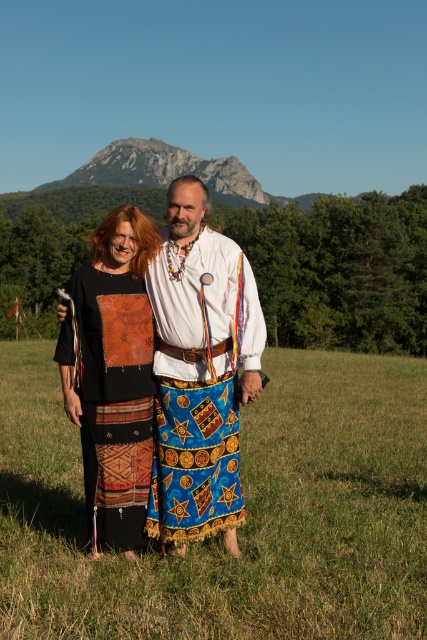
Question: Does textured fabric skirt at center appear on the left side of rugged stone mountain at upper center?

Choices:
 (A) yes
 (B) no

Answer: (B)

Question: Is textured fabric skirt at center above rugged stone mountain at upper center?

Choices:
 (A) no
 (B) yes

Answer: (A)

Question: Estimate the real-world distances between objects in this image. Which object is farther from the green grass at center?

Choices:
 (A) leather patchwork dress at center
 (B) textured fabric skirt at center

Answer: (A)

Question: Which point is farther to the camera?

Choices:
 (A) (128, 305)
 (B) (186, 625)
 (C) (70, 176)
 (D) (160, 266)

Answer: (C)

Question: Considering the relative positions of blue printed skirt at center and rugged stone mountain at upper center in the image provided, where is blue printed skirt at center located with respect to rugged stone mountain at upper center?

Choices:
 (A) below
 (B) above

Answer: (A)

Question: Which point is farther to the camera?

Choices:
 (A) tap(64, 323)
 (B) tap(389, 497)
 (C) tap(215, 161)
 (D) tap(237, 273)

Answer: (C)